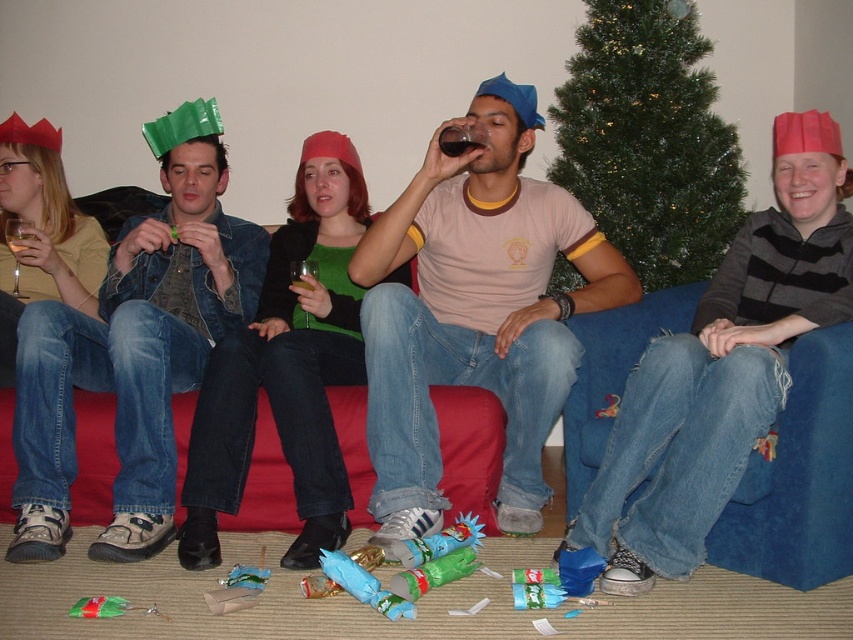
You are a guest at the holiday party and want to place your coat on the floor near the green artificial christmas tree at upper center without blocking the translucent glass at center. Considering their sizes, is there enough space?

The green artificial christmas tree at upper center is larger in size than the translucent glass at center, so placing the coat near the tree while avoiding the glass should be possible as the tree takes up more space.

You are a guest at a holiday party and want to place your drink on a surface near the green artificial christmas tree at upper center without moving too far from your seat. The translucent glass at center is already holding another guest s drink. Is there enough space between them to place your drink?

The green artificial christmas tree at upper center and translucent glass at center are 3.82 feet apart. Since the distance between them is more than enough for placing a drink, you can safely put your drink near the green artificial christmas tree at upper center without moving too far from your seat.

You are at a holiday party and want to pour a drink into the tallest glass available. Which glass should you choose between the transparent glass at upper left and the translucent glass at center?

The transparent glass at upper left has a greater height compared to the translucent glass at center, so you should choose the transparent glass at upper left.